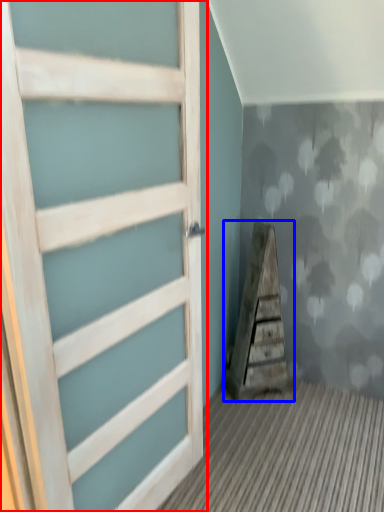
Question: Which object appears farthest to the camera in this image, door (highlighted by a red box) or stairwell (highlighted by a blue box)?

Choices:
 (A) door
 (B) stairwell

Answer: (B)